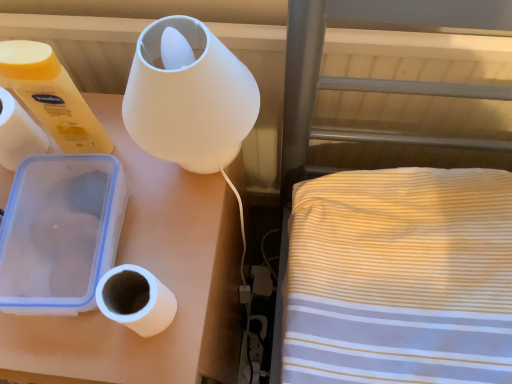
Question: In terms of height, does white matte paper towel at left look taller or shorter compared to white matte toilet paper at left, positioned as the first toilet paper in top-to-bottom order?

Choices:
 (A) short
 (B) tall

Answer: (A)

Question: Considering the positions of white matte paper towel at left and white matte toilet paper at left, which is the second toilet paper from bottom to top, in the image, is white matte paper towel at left bigger or smaller than white matte toilet paper at left, which is the second toilet paper from bottom to top,?

Choices:
 (A) big
 (B) small

Answer: (B)

Question: Which is farther from the white matte lamp at upper left?

Choices:
 (A) white matte toilet paper at left, positioned as the first toilet paper in top-to-bottom order
 (B) white matte toilet paper at lower left, which is counted as the 2th toilet paper, starting from the left
 (C) frosted glass lamp at upper center
 (D) white matte paper towel at left

Answer: (D)

Question: Considering the real-world distances, which object is closest to the white matte paper towel at left?

Choices:
 (A) white matte lamp at upper left
 (B) white matte toilet paper at lower left, positioned as the first toilet paper in right-to-left order
 (C) white matte toilet paper at left, positioned as the 2th toilet paper in right-to-left order
 (D) frosted glass lamp at upper center

Answer: (C)